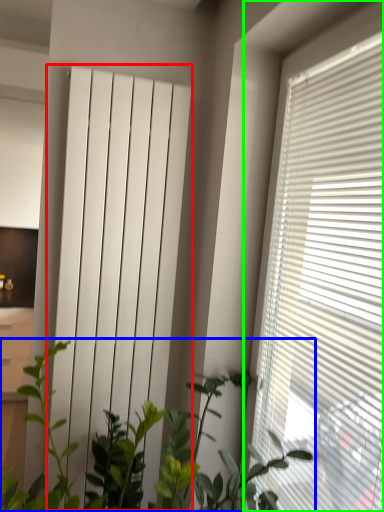
Question: Estimate the real-world distances between objects in this image. Which object is farther from curtain (highlighted by a red box), houseplant (highlighted by a blue box) or window blind (highlighted by a green box)?

Choices:
 (A) houseplant
 (B) window blind

Answer: (B)